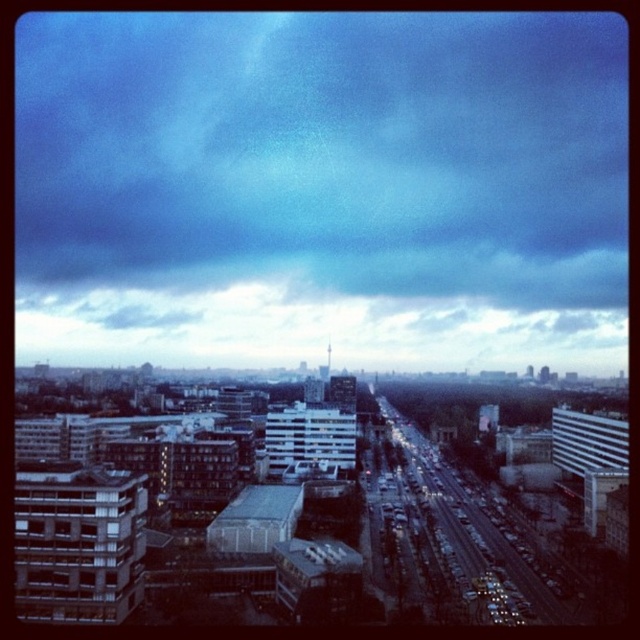
Question: Among these objects, which one is farthest from the camera?

Choices:
 (A) cloudy sky at center
 (B) dark blue cloud at upper center

Answer: (A)

Question: Observing the image, what is the correct spatial positioning of dark blue cloud at upper center in reference to cloudy sky at center?

Choices:
 (A) right
 (B) left

Answer: (B)

Question: Which point is closer to the camera?

Choices:
 (A) (145, 131)
 (B) (150, 342)

Answer: (B)

Question: Can you confirm if dark blue cloud at upper center is positioned above cloudy sky at center?

Choices:
 (A) yes
 (B) no

Answer: (A)

Question: Which object is farther from the camera taking this photo?

Choices:
 (A) dark blue cloud at upper center
 (B) cloudy sky at center

Answer: (B)

Question: Can you confirm if dark blue cloud at upper center is thinner than cloudy sky at center?

Choices:
 (A) no
 (B) yes

Answer: (A)